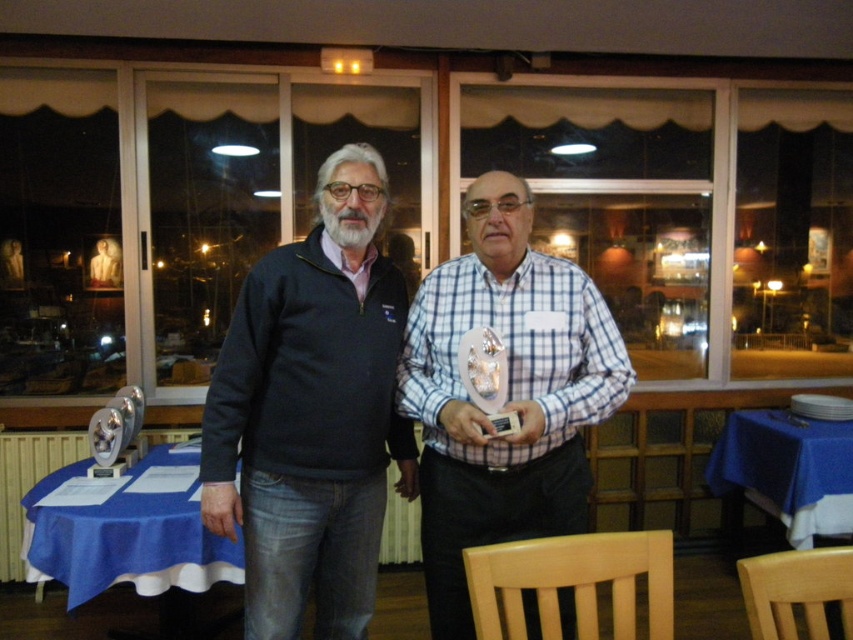
You are organizing an event and need to place a tall vase that requires a stable, higher surface. Based on the scene, which table between the blue fabric table at lower left and the blue cloth table at lower right should you choose?

The blue cloth table at lower right is taller than the blue fabric table at lower left, so you should choose the blue cloth table at lower right for placing the tall vase as it provides a higher and more stable surface.

Looking at this image, you are a photographer positioned at the blue fabric table at lower left and want to take a photo of the white checkered shirt at center. Based on the distance between them, can you estimate whether you need to adjust your camera focus to capture the subject clearly?

The distance between the white checkered shirt at center and the blue fabric table at lower left is 37.24 inches. Since this distance is within typical camera focus range, you can capture the subject clearly without needing to adjust the focus.

You are organizing an event and need to place a 2.5 feet wide banner between the blue fabric table at lower left and the blue cloth table at lower right. Can the space between them accommodate the banner?

The blue fabric table at lower left is wider than the blue cloth table at lower right, but the description does not provide the exact distance between them. Therefore, it is unclear if the 2.5 feet wide banner can fit between them.